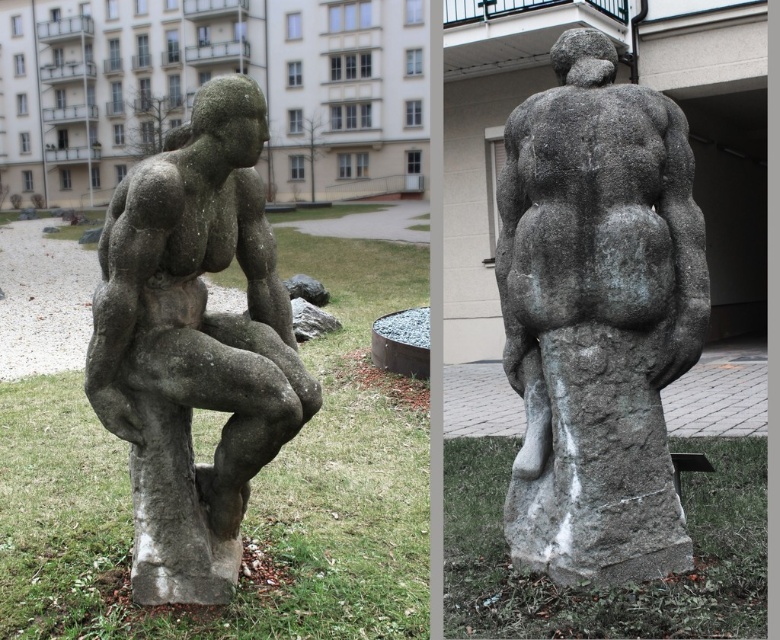
Is gray stone statue at center below gray stone statue at left?

Actually, gray stone statue at center is above gray stone statue at left.

Is point (594, 292) in front of point (176, 321)?

No, it is behind (176, 321).

Between point (658, 236) and point (211, 163), which one is positioned behind?

The point (658, 236) is more distant.

Find the location of a particular element. gray stone statue at center is located at coordinates (597, 317).